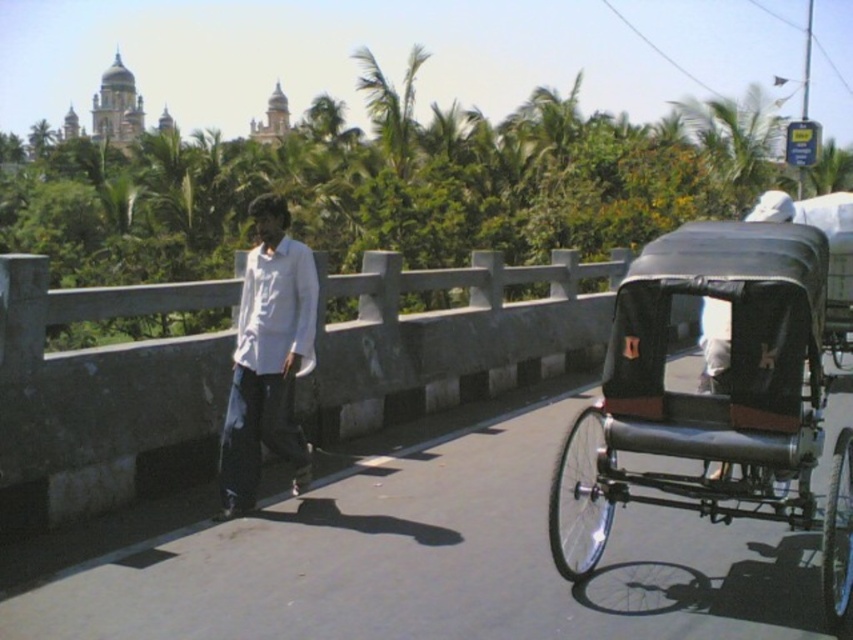
Which of these two, black leather rickshaw at right or white matte shirt at center, stands shorter?

black leather rickshaw at right

Locate an element on the screen. The height and width of the screenshot is (640, 853). black leather rickshaw at right is located at coordinates (717, 390).